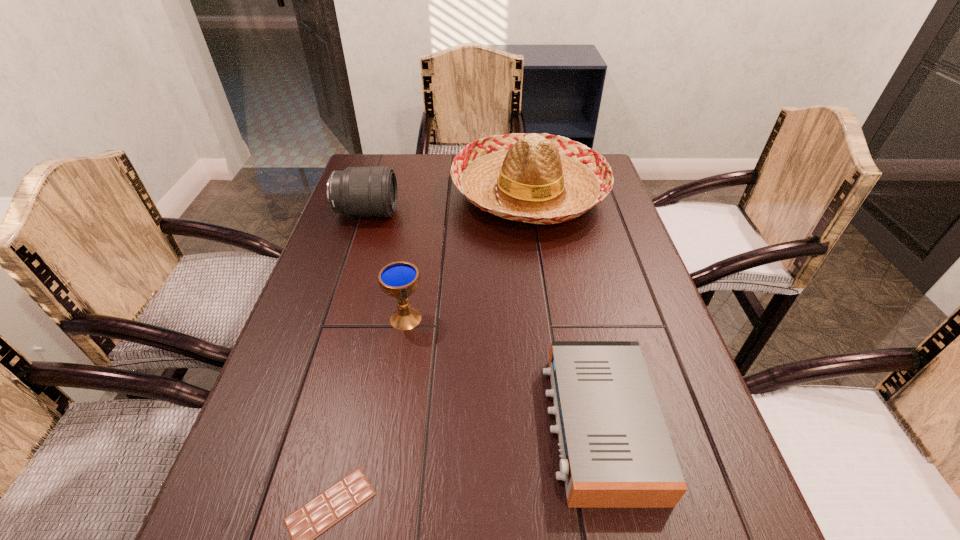
Where is `object at the far edge`? This screenshot has height=540, width=960. object at the far edge is located at coordinates (534, 178).

In order to click on object located at the left edge in this screenshot , I will do `click(357, 191)`.

Identify the location of sombrero present at the right edge. Image resolution: width=960 pixels, height=540 pixels. (534, 178).

This screenshot has height=540, width=960. Find the location of `radio receiver at the right edge`. radio receiver at the right edge is located at coordinates (616, 452).

Identify the location of object present at the far right corner. The height and width of the screenshot is (540, 960). (534, 178).

In the image, there is a desktop. Find the location of `vacant space at the left edge`. vacant space at the left edge is located at coordinates (324, 439).

Locate an element on the screen. free space at the right edge of the desktop is located at coordinates 665,415.

In the image, there is a desktop. Identify the location of free space at the far left corner. (406, 159).

Locate an element on the screen. This screenshot has height=540, width=960. free space that is in between the tallest object and the third nearest object is located at coordinates (468, 255).

Identify the location of empty location between the telephoto lens and the radio receiver. (483, 319).